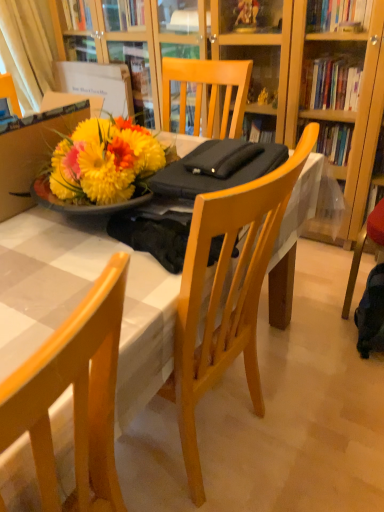
Question: Is dark blue fabric backpack at lower right at the back of white glossy table at center?

Choices:
 (A) no
 (B) yes

Answer: (A)

Question: Is white glossy table at center oriented towards dark blue fabric backpack at lower right?

Choices:
 (A) no
 (B) yes

Answer: (A)

Question: From a real-world perspective, is white glossy table at center over dark blue fabric backpack at lower right?

Choices:
 (A) yes
 (B) no

Answer: (A)

Question: Is white glossy table at center thinner than dark blue fabric backpack at lower right?

Choices:
 (A) yes
 (B) no

Answer: (B)

Question: Can you confirm if white glossy table at center is taller than dark blue fabric backpack at lower right?

Choices:
 (A) yes
 (B) no

Answer: (A)

Question: Considering the positions of point (51, 35) and point (92, 464), is point (51, 35) closer or farther from the camera than point (92, 464)?

Choices:
 (A) farther
 (B) closer

Answer: (A)

Question: In the image, is white fabric curtain at upper left positioned in front of or behind wooden chair at center?

Choices:
 (A) front
 (B) behind

Answer: (B)

Question: From a real-world perspective, is white fabric curtain at upper left positioned above or below wooden chair at center?

Choices:
 (A) above
 (B) below

Answer: (A)

Question: In terms of size, does white fabric curtain at upper left appear bigger or smaller than wooden chair at center?

Choices:
 (A) small
 (B) big

Answer: (A)

Question: Is wooden chair at center wider or thinner than dark blue fabric backpack at lower right?

Choices:
 (A) wide
 (B) thin

Answer: (A)

Question: Based on their sizes in the image, would you say wooden chair at center is bigger or smaller than dark blue fabric backpack at lower right?

Choices:
 (A) big
 (B) small

Answer: (A)

Question: Is wooden chair at center taller or shorter than dark blue fabric backpack at lower right?

Choices:
 (A) short
 (B) tall

Answer: (B)

Question: Does point (49, 444) appear closer or farther from the camera than point (369, 294)?

Choices:
 (A) closer
 (B) farther

Answer: (A)

Question: From a real-world perspective, is white glossy table at center above or below wooden chair at center?

Choices:
 (A) above
 (B) below

Answer: (B)

Question: Is white glossy table at center situated inside wooden chair at center or outside?

Choices:
 (A) inside
 (B) outside

Answer: (B)